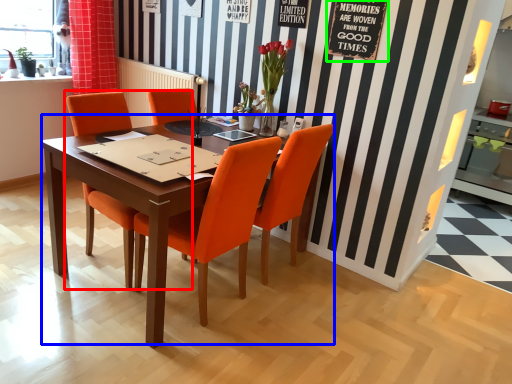
Question: Based on their relative distances, which object is farther from chair (highlighted by a red box)? Choose from kitchen & dining room table (highlighted by a blue box) and bulletin board (highlighted by a green box).

Choices:
 (A) kitchen & dining room table
 (B) bulletin board

Answer: (B)